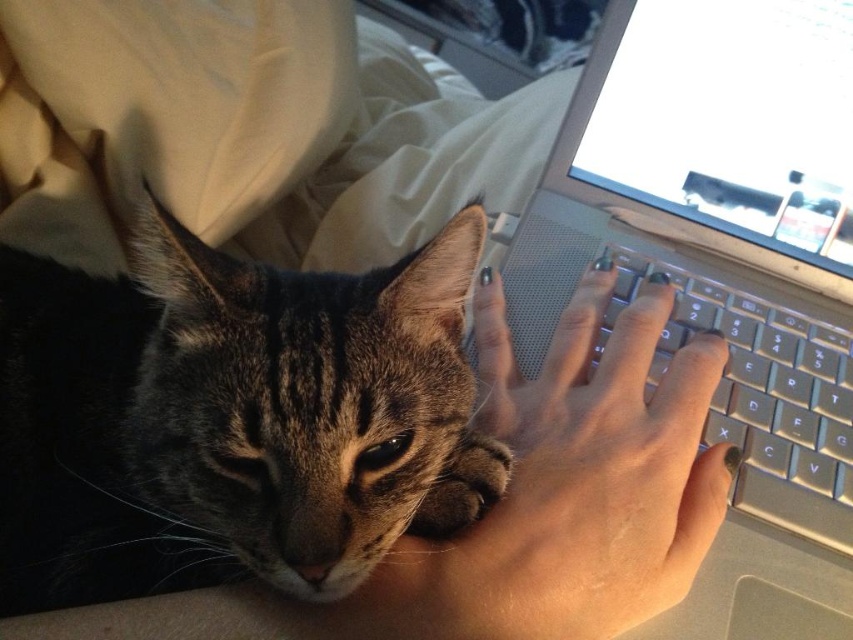
You are a robotic arm trying to place a small object between the smooth skin hand at center and the silver metallic keyboard at center right. Can you fit it there if the object is 10 cm wide?

The smooth skin hand at center is wider than the silver metallic keyboard at center right. Since the object is 10 cm wide, it might fit depending on the exact space between them, but the description only states the hand is wider, not the available space. Without specific measurements of the gap, it is uncertain.

You are a photographer standing in front of the tabby fur cat at center. You want to take a closeup photo of the cat without moving it. Considering your current position, can you get a clear closeup shot if your camera has a minimum focusing distance of 50 centimeters?

The tabby fur cat at center is 49.28 centimeters away from viewer, which is within the camera minimum focusing distance of 50 centimeters. Therefore, you can get a clear closeup shot without moving the cat.